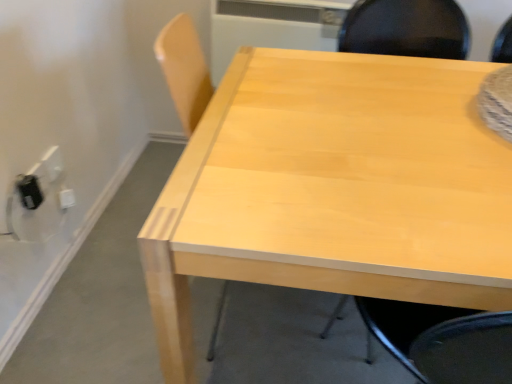
Question: In terms of width, does light wood table at center look wider or thinner when compared to black plastic outlet at lower left, which is the 1th electric outlet from front to back?

Choices:
 (A) wide
 (B) thin

Answer: (A)

Question: Based on their sizes in the image, would you say light wood table at center is bigger or smaller than black plastic outlet at lower left, which is the 1th electric outlet from front to back?

Choices:
 (A) big
 (B) small

Answer: (A)

Question: Which is farther from the light wood table at center?

Choices:
 (A) light wood chair at upper right
 (B) black plastic outlet at lower left, which is the 1th electric outlet from front to back
 (C) white plastic electric outlet at lower left, the second electric outlet in the front-to-back sequence

Answer: (C)

Question: Which is farther from the light wood chair at upper right?

Choices:
 (A) black plastic outlet at lower left, which is the 1th electric outlet from front to back
 (B) light wood table at center
 (C) white plastic electric outlet at lower left, the second electric outlet in the front-to-back sequence

Answer: (A)